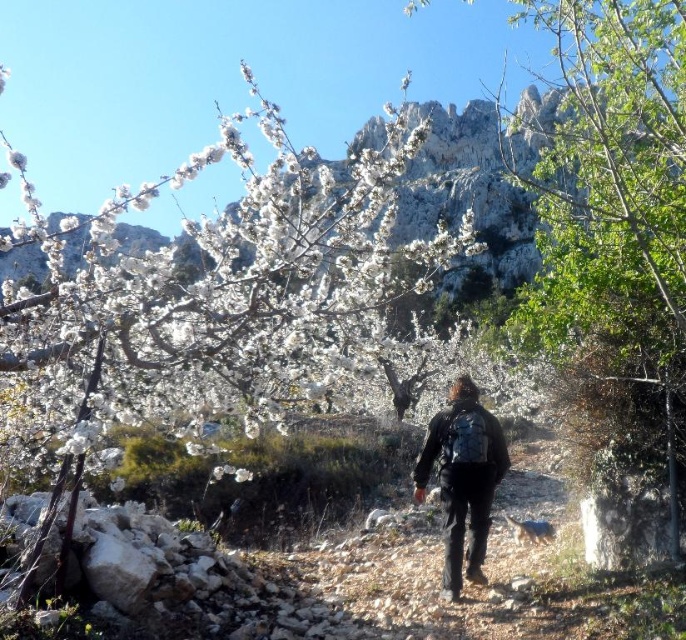
Question: Which point is closer to the camera?

Choices:
 (A) (447, 570)
 (B) (370, 180)

Answer: (A)

Question: Which of the following is the farthest from the observer?

Choices:
 (A) (461, 420)
 (B) (272, 244)

Answer: (B)

Question: Which of the following is the closest to the observer?

Choices:
 (A) (390, 387)
 (B) (438, 474)

Answer: (B)

Question: Is white fluffy blossoms at upper left to the left of black matte backpack at center from the viewer's perspective?

Choices:
 (A) yes
 (B) no

Answer: (A)

Question: Can you confirm if white fluffy blossoms at upper left is positioned above black matte backpack at center?

Choices:
 (A) no
 (B) yes

Answer: (B)

Question: Is white fluffy blossoms at upper left below black matte backpack at center?

Choices:
 (A) no
 (B) yes

Answer: (A)